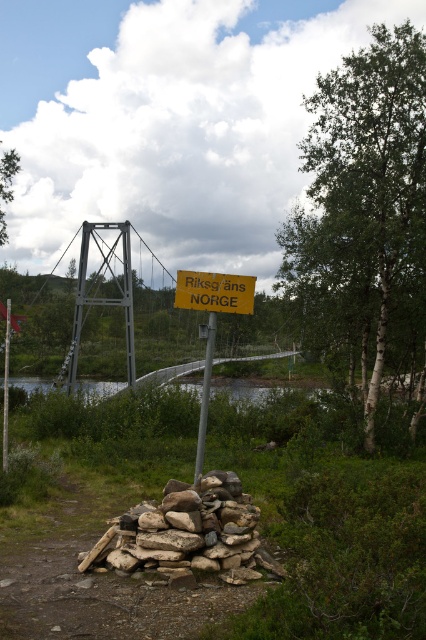
Does yellow matte sign at center have a lesser width compared to silver metallic pole at center?

No.

In the scene shown: Does yellow matte sign at center have a smaller size compared to silver metallic pole at center?

No, yellow matte sign at center is not smaller than silver metallic pole at center.

Is point (195, 292) less distant than point (198, 444)?

Yes, it is.

Locate an element on the screen. yellow matte sign at center is located at coordinates (212, 324).

Which is more to the right, clear water at center or silver metallic pole at center?

From the viewer's perspective, silver metallic pole at center appears more on the right side.

Is point (316, 387) positioned behind point (207, 337)?

Yes, point (316, 387) is behind point (207, 337).

What are the coordinates of `clear water at center` in the screenshot? It's located at (242, 388).

Which of these two, rough textured stones at center or yellow paper sign at center, stands taller?

With more height is yellow paper sign at center.

Who is shorter, rough textured stones at center or yellow paper sign at center?

rough textured stones at center is shorter.

Does point (158, 513) come behind point (201, 284)?

No.

Identify the location of rough textured stones at center. The image size is (426, 640). (189, 532).